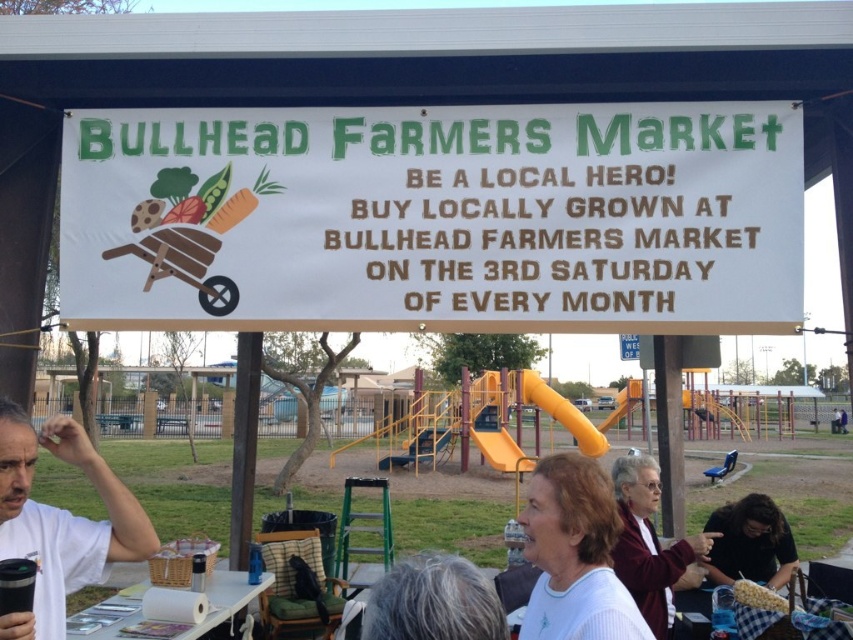
You are a photographer standing at the Bullhead Farmers Market. You want to take a photo of the white striped shirt at lower center and the white paper at lower center. The minimum distance required for your camera to focus on both subjects clearly is 2.5 meters. Will your camera be able to capture both subjects in focus at the same time?

The white striped shirt at lower center is 2.40 meters from the white paper at lower center. Since the distance between them is less than the camera requirement of 2.5 meters, the camera may not be able to focus on both subjects clearly at the same time.

You are standing at the Bullhead Farmers Market and want to take a photo of the banner. You notice two points in the scene marked as point A and point B. Point A is at coordinates [750,513] and point B is at [100,628]. If you want to ensure both points are in focus, which point should you focus on first to maximize the depth of field?

You should focus on point A first because it is closer to the viewer than point B, allowing the depth of field to extend further behind it and potentially include both points in focus.

You are a vendor at the Bullhead Farmers Market and want to place your white paper sign at center next to your white striped shirt at lower center. Can the sign be placed to the side of the shirt without overlapping?

The white paper sign at center is wider than the white striped shirt at lower center, so it can be placed to the side without overlapping as there is enough space.